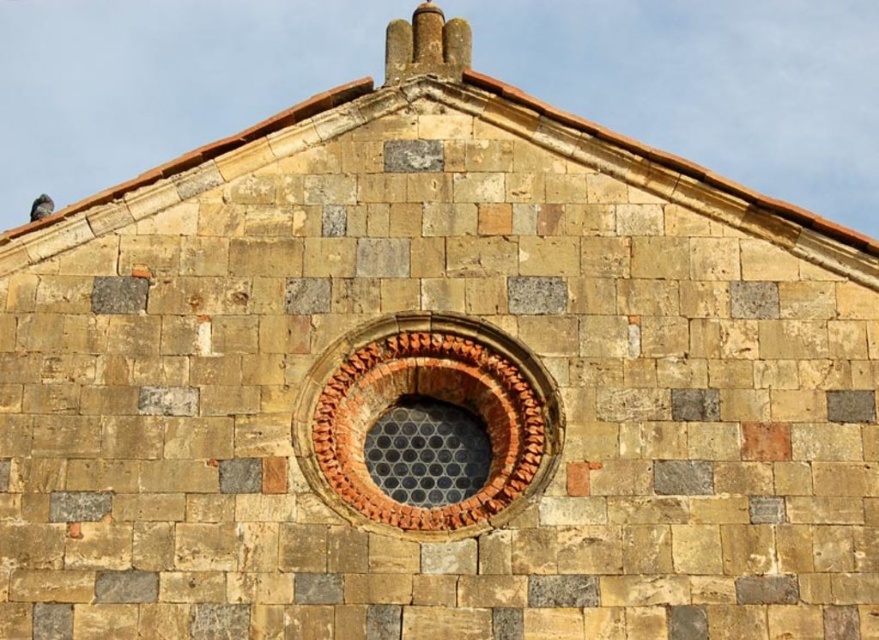
You are a bird perched on a branch outside the historical building. You want to fly to the gray feathered pigeon at upper left but need to avoid flying through the terracotta brick window at center. Which direction should you fly to reach the pigeon without passing through the window?

The terracotta brick window at center is in front of the gray feathered pigeon at upper left, so to avoid the window, you should fly upward and to the left to reach the pigeon without passing through the window.

You are an architect analyzing the structure of the building. You notice the terracotta brick window at center and the gray feathered pigeon at upper left. Which object occupies a larger vertical space in the image?

The gray feathered pigeon at upper left is taller than the terracotta brick window at center, so it occupies a larger vertical space in the image.

You are an architect examining the historical building. You notice the terracotta brick window at center and the gray feathered pigeon at upper left. Which object is positioned more to the right side of the building?

The terracotta brick window at center is positioned more to the right side of the building than the gray feathered pigeon at upper left.